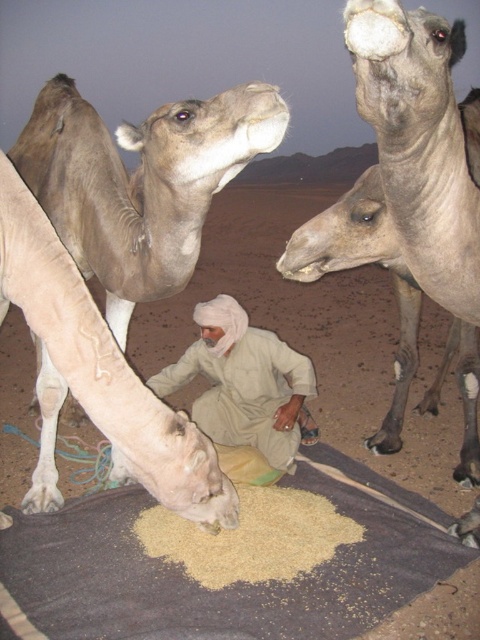
Is gray matte camel at upper right to the right of brown grain at lower center from the viewer's perspective?

Yes, gray matte camel at upper right is to the right of brown grain at lower center.

Is gray matte camel at upper right shorter than brown grain at lower center?

No, gray matte camel at upper right is not shorter than brown grain at lower center.

Is point (459, 292) positioned before point (253, 536)?

Yes, point (459, 292) is in front of point (253, 536).

Locate an element on the screen. The image size is (480, 640). gray matte camel at upper right is located at coordinates (409, 195).

Which is more to the right, gray matte camel at upper right or light brown fur at center?

gray matte camel at upper right

Who is lower down, gray matte camel at upper right or light brown fur at center?

gray matte camel at upper right

Between point (442, 278) and point (172, 241), which one is positioned in front?

Point (442, 278)

Where is `gray matte camel at upper right`? Image resolution: width=480 pixels, height=640 pixels. gray matte camel at upper right is located at coordinates (409, 195).

Does gray matte camel at upper right appear on the left side of light beige cotton clothing at center?

Incorrect, gray matte camel at upper right is not on the left side of light beige cotton clothing at center.

Can you confirm if gray matte camel at upper right is shorter than light beige cotton clothing at center?

No, gray matte camel at upper right is not shorter than light beige cotton clothing at center.

Is point (370, 195) positioned in front of point (206, 349)?

Yes, it is.

You are a GUI agent. You are given a task and a screenshot of the screen. Output one action in this format:
    pyautogui.click(x=<x>, y=<y>)
    Task: Click on the gray matte camel at upper right
    Image resolution: width=480 pixels, height=640 pixels.
    Given the screenshot: What is the action you would take?
    pyautogui.click(x=409, y=195)